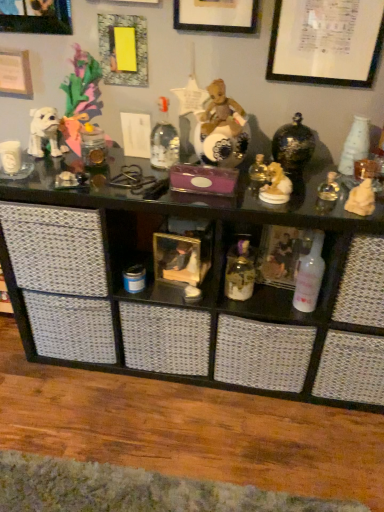
What is the approximate height of brushed metal picture frame at upper left, the fourth picture frame when ordered from right to left?

brushed metal picture frame at upper left, the fourth picture frame when ordered from right to left, is 9.96 inches in height.

Where is `gold ceramic dog at upper right, the 1th toy positioned from the left`? This screenshot has height=512, width=384. gold ceramic dog at upper right, the 1th toy positioned from the left is located at coordinates coord(276,186).

Where is `white matte picture frame at upper center, placed as the second picture frame when sorted from right to left`? The width and height of the screenshot is (384, 512). white matte picture frame at upper center, placed as the second picture frame when sorted from right to left is located at coordinates (216, 15).

Where is `white paper at upper left, the 5th picture frame from the right`? The height and width of the screenshot is (512, 384). white paper at upper left, the 5th picture frame from the right is located at coordinates (15, 73).

Is point (259, 198) farther from viewer compared to point (364, 199)?

Yes, it is behind point (364, 199).

Looking at this image, is gold ceramic dog at upper right, the 1th toy positioned from the left, touching light brown stone statue at right, marked as the first toy in a right-to-left arrangement?

No.

From the image's perspective, is gold ceramic dog at upper right, the 1th toy positioned from the left, above light brown stone statue at right, marked as the first toy in a right-to-left arrangement?

Yes, from the image's perspective, gold ceramic dog at upper right, the 1th toy positioned from the left, is on top of light brown stone statue at right, marked as the first toy in a right-to-left arrangement.

Can you see brushed metal picture frame at upper left, placed as the second picture frame when sorted from left to right, touching white glossy bottle at center-right?

No, brushed metal picture frame at upper left, placed as the second picture frame when sorted from left to right, is not making contact with white glossy bottle at center-right.

Based on the photo, from a real-world perspective, is brushed metal picture frame at upper left, the fourth picture frame when ordered from right to left, over white glossy bottle at center-right?

Correct, in the physical world, brushed metal picture frame at upper left, the fourth picture frame when ordered from right to left, is higher than white glossy bottle at center-right.

Choose the correct answer: Is brushed metal picture frame at upper left, the fourth picture frame when ordered from right to left, inside white glossy bottle at center-right or outside it?

brushed metal picture frame at upper left, the fourth picture frame when ordered from right to left, cannot be found inside white glossy bottle at center-right.

Looking at this image, does brushed metal picture frame at upper left, the fourth picture frame when ordered from right to left, come in front of white glossy bottle at center-right?

No, the depth of brushed metal picture frame at upper left, the fourth picture frame when ordered from right to left, is greater than that of white glossy bottle at center-right.

From the image's perspective, is translucent glass jar at center located above gold ceramic dog at upper right, the 1th toy positioned from the left?

Actually, translucent glass jar at center appears below gold ceramic dog at upper right, the 1th toy positioned from the left, in the image.

Is translucent glass jar at center aimed at gold ceramic dog at upper right, the 2th toy positioned from the right?

No, translucent glass jar at center is not aimed at gold ceramic dog at upper right, the 2th toy positioned from the right.

Is translucent glass jar at center at the right side of gold ceramic dog at upper right, the 2th toy positioned from the right?

Incorrect, translucent glass jar at center is not on the right side of gold ceramic dog at upper right, the 2th toy positioned from the right.

Is translucent glass jar at center taller than gold ceramic dog at upper right, the 1th toy positioned from the left?

Correct, translucent glass jar at center is much taller as gold ceramic dog at upper right, the 1th toy positioned from the left.

Is white paper at upper right, placed as the 5th picture frame when sorted from left to right, at the left side of yellow paper at upper left, which is the third picture frame in right-to-left order?

Incorrect, white paper at upper right, placed as the 5th picture frame when sorted from left to right, is not on the left side of yellow paper at upper left, which is the third picture frame in right-to-left order.

Considering the sizes of objects white paper at upper right, marked as the 1th picture frame in a right-to-left arrangement, and yellow paper at upper left, which is the third picture frame in right-to-left order, in the image provided, who is thinner, white paper at upper right, marked as the 1th picture frame in a right-to-left arrangement, or yellow paper at upper left, which is the third picture frame in right-to-left order,?

With smaller width is white paper at upper right, marked as the 1th picture frame in a right-to-left arrangement.

From the image's perspective, which one is positioned lower, white paper at upper right, marked as the 1th picture frame in a right-to-left arrangement, or yellow paper at upper left, which is the third picture frame in right-to-left order?

yellow paper at upper left, which is the third picture frame in right-to-left order.

Which of these two, white paper at upper right, marked as the 1th picture frame in a right-to-left arrangement, or yellow paper at upper left, which is counted as the 3th picture frame, starting from the left, is bigger?

With larger size is white paper at upper right, marked as the 1th picture frame in a right-to-left arrangement.

How distant is white matte picture frame at upper center, which is counted as the 4th picture frame, starting from the left, from yellow paper at upper left, which is the third picture frame in right-to-left order?

white matte picture frame at upper center, which is counted as the 4th picture frame, starting from the left, and yellow paper at upper left, which is the third picture frame in right-to-left order, are 21.32 centimeters apart.

Which is more to the right, white matte picture frame at upper center, placed as the second picture frame when sorted from right to left, or yellow paper at upper left, which is counted as the 3th picture frame, starting from the left?

white matte picture frame at upper center, placed as the second picture frame when sorted from right to left, is more to the right.

From the image's perspective, is white matte picture frame at upper center, which is counted as the 4th picture frame, starting from the left, under yellow paper at upper left, which is counted as the 3th picture frame, starting from the left?

No, from the image's perspective, white matte picture frame at upper center, which is counted as the 4th picture frame, starting from the left, is not below yellow paper at upper left, which is counted as the 3th picture frame, starting from the left.

Is white matte picture frame at upper center, placed as the second picture frame when sorted from right to left, with yellow paper at upper left, which is counted as the 3th picture frame, starting from the left?

No, white matte picture frame at upper center, placed as the second picture frame when sorted from right to left, is not touching yellow paper at upper left, which is counted as the 3th picture frame, starting from the left.

Looking at this image, is white matte picture frame at upper center, which is counted as the 4th picture frame, starting from the left, positioned beyond the bounds of white paper at upper right, placed as the 5th picture frame when sorted from left to right?

Yes.

Looking at this image, does white matte picture frame at upper center, which is counted as the 4th picture frame, starting from the left, appear on the left side of white paper at upper right, placed as the 5th picture frame when sorted from left to right?

Correct, you'll find white matte picture frame at upper center, which is counted as the 4th picture frame, starting from the left, to the left of white paper at upper right, placed as the 5th picture frame when sorted from left to right.

Are white matte picture frame at upper center, which is counted as the 4th picture frame, starting from the left, and white paper at upper right, marked as the 1th picture frame in a right-to-left arrangement, located far from each other?

No, white matte picture frame at upper center, which is counted as the 4th picture frame, starting from the left, is in close proximity to white paper at upper right, marked as the 1th picture frame in a right-to-left arrangement.

Measure the distance between white matte picture frame at upper center, placed as the second picture frame when sorted from right to left, and white paper at upper right, marked as the 1th picture frame in a right-to-left arrangement.

They are 8.60 inches apart.

Between yellow paper at upper left, which is the third picture frame in right-to-left order, and gold ceramic dog at upper right, the 2th toy positioned from the right, which one has larger width?

Wider between the two is gold ceramic dog at upper right, the 2th toy positioned from the right.

Based on the photo, what's the angular difference between yellow paper at upper left, which is the third picture frame in right-to-left order, and gold ceramic dog at upper right, the 1th toy positioned from the left,'s facing directions?

yellow paper at upper left, which is the third picture frame in right-to-left order, and gold ceramic dog at upper right, the 1th toy positioned from the left, are facing 1.23 degrees away from each other.

Locate an element on the screen. The image size is (384, 512). the 1st toy to the right when counting from the yellow paper at upper left, which is counted as the 3th picture frame, starting from the left is located at coordinates (276, 186).

From a real-world perspective, is yellow paper at upper left, which is the third picture frame in right-to-left order, physically located above or below gold ceramic dog at upper right, the 1th toy positioned from the left?

yellow paper at upper left, which is the third picture frame in right-to-left order, is above gold ceramic dog at upper right, the 1th toy positioned from the left.

You are a GUI agent. You are given a task and a screenshot of the screen. Output one action in this format:
    pyautogui.click(x=<x>, y=<y>)
    Task: Click on the toy located above the light brown stone statue at right, marked as the first toy in a right-to-left arrangement (from a real-world perspective)
    This screenshot has width=384, height=512.
    Given the screenshot: What is the action you would take?
    pyautogui.click(x=276, y=186)

This screenshot has width=384, height=512. Find the location of `bottle lying on the right of brushed metal picture frame at upper left, the fourth picture frame when ordered from right to left`. bottle lying on the right of brushed metal picture frame at upper left, the fourth picture frame when ordered from right to left is located at coordinates (309, 276).

Looking at this image, when comparing their distances from gold ceramic dog at upper right, the 1th toy positioned from the left, does wooden framed picture at center, arranged as the second shelf when viewed from the right, or black glass shelf at upper center, positioned as the second shelf in left-to-right order, seem closer?

The object closer to gold ceramic dog at upper right, the 1th toy positioned from the left, is wooden framed picture at center, arranged as the second shelf when viewed from the right.

Based on the photo, when comparing their distances from yellow paper at upper left, which is the third picture frame in right-to-left order, does black glass shelf at upper center, positioned as the second shelf in left-to-right order, or brushed metal picture frame at upper left, placed as the second picture frame when sorted from left to right, seem closer?

brushed metal picture frame at upper left, placed as the second picture frame when sorted from left to right, is closer to yellow paper at upper left, which is the third picture frame in right-to-left order.

Estimate the real-world distances between objects in this image. Which object is further from gold ceramic dog at upper right, the 2th toy positioned from the right, translucent glass jar at center or wooden framed picture at center, arranged as the second shelf when viewed from the right?

wooden framed picture at center, arranged as the second shelf when viewed from the right, is positioned further to the anchor gold ceramic dog at upper right, the 2th toy positioned from the right.

When comparing their distances from translucent glass jar at center, does white paper at upper left, the 1th picture frame in the left-to-right sequence, or black glass shelf at upper center, positioned as the second shelf in left-to-right order, seem closer?

black glass shelf at upper center, positioned as the second shelf in left-to-right order, lies closer to translucent glass jar at center than the other object.

From the image, which object appears to be nearer to black glass shelf at upper center, positioned as the second shelf in left-to-right order, translucent glass jar at center or white glossy bottle at center-right?

Based on the image, translucent glass jar at center appears to be nearer to black glass shelf at upper center, positioned as the second shelf in left-to-right order.

Which object lies further to the anchor point yellow paper at upper left, which is the third picture frame in right-to-left order, white glossy bottle at center-right or black glass shelf at upper center, which is the first shelf from right to left?

white glossy bottle at center-right.

From the image, which object appears to be farther from gold ceramic dog at upper right, the 2th toy positioned from the right, translucent glass jar at center or yellow paper at upper left, which is counted as the 3th picture frame, starting from the left?

Based on the image, yellow paper at upper left, which is counted as the 3th picture frame, starting from the left, appears to be further to gold ceramic dog at upper right, the 2th toy positioned from the right.

Considering their positions, is brushed metal picture frame at upper left, the fourth picture frame when ordered from right to left, positioned further to white paper at upper right, placed as the 5th picture frame when sorted from left to right, than gold ceramic dog at upper right, the 2th toy positioned from the right?

The object further to white paper at upper right, placed as the 5th picture frame when sorted from left to right, is brushed metal picture frame at upper left, the fourth picture frame when ordered from right to left.

Locate an element on the screen. Image resolution: width=384 pixels, height=512 pixels. picture frame between yellow paper at upper left, which is the third picture frame in right-to-left order, and translucent glass jar at center from top to bottom is located at coordinates (15, 73).

This screenshot has height=512, width=384. What are the coordinates of `shelf between yellow paper at upper left, which is the third picture frame in right-to-left order, and black glass shelf at upper center, positioned as the second shelf in left-to-right order, vertically` in the screenshot? It's located at (213, 272).

At what (x,y) coordinates should I click in order to perform the action: click on shelf that lies between white paper at upper right, placed as the 5th picture frame when sorted from left to right, and translucent glass jar at center from top to bottom. Please return your answer as a coordinate pair (x, y). Looking at the image, I should click on (213, 272).

This screenshot has width=384, height=512. Find the location of `toiletry between black glass shelf at upper center, positioned as the second shelf in left-to-right order, and white glossy bottle at center-right from left to right`. toiletry between black glass shelf at upper center, positioned as the second shelf in left-to-right order, and white glossy bottle at center-right from left to right is located at coordinates (239, 272).